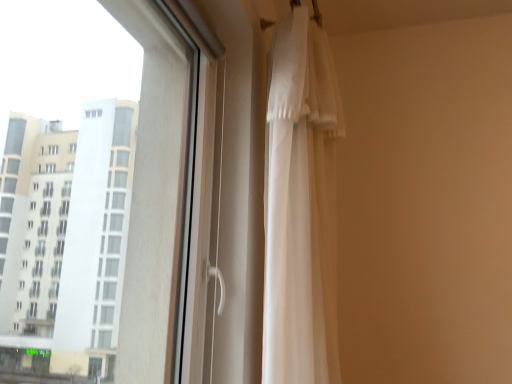
Question: Considering the positions of white sheer curtain at right and transparent glass window at upper left in the image, is white sheer curtain at right wider or thinner than transparent glass window at upper left?

Choices:
 (A) thin
 (B) wide

Answer: (A)

Question: Is white sheer curtain at right in front of or behind transparent glass window at upper left in the image?

Choices:
 (A) behind
 (B) front

Answer: (A)

Question: Based on their positions, is white sheer curtain at right located to the left or right of transparent glass window at upper left?

Choices:
 (A) left
 (B) right

Answer: (B)

Question: From a real-world perspective, is transparent glass window at upper left physically located above or below white sheer curtain at right?

Choices:
 (A) below
 (B) above

Answer: (A)

Question: Is transparent glass window at upper left bigger or smaller than white sheer curtain at right?

Choices:
 (A) small
 (B) big

Answer: (B)

Question: Considering the positions of point (176, 203) and point (313, 62), is point (176, 203) closer or farther from the camera than point (313, 62)?

Choices:
 (A) farther
 (B) closer

Answer: (B)

Question: Is transparent glass window at upper left spatially inside white sheer curtain at right, or outside of it?

Choices:
 (A) outside
 (B) inside

Answer: (A)